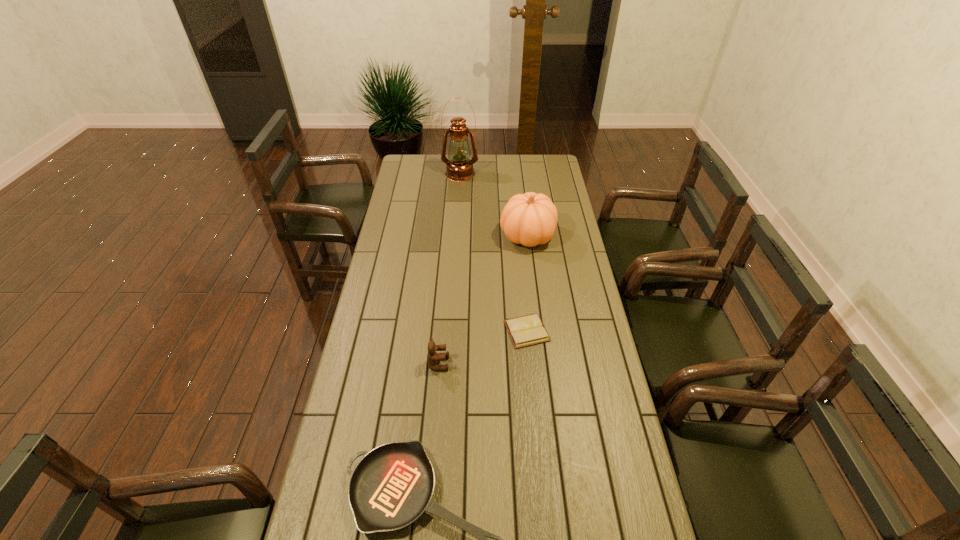
This screenshot has height=540, width=960. I want to click on vacant space situated on the face of the teddy bear, so click(548, 363).

What are the coordinates of `free space located 0.360m on the left of the third farthest object` in the screenshot? It's located at (403, 331).

Locate an element on the screen. This screenshot has height=540, width=960. object that is at the far edge is located at coordinates pos(459,168).

This screenshot has width=960, height=540. In order to click on object present at the right edge in this screenshot , I will do `click(529, 219)`.

In the image, there is a desktop. In order to click on vacant space at the far edge in this screenshot , I will do `click(437, 175)`.

You are a GUI agent. You are given a task and a screenshot of the screen. Output one action in this format:
    pyautogui.click(x=<x>, y=<y>)
    Task: Click on the free space at the left edge
    The width and height of the screenshot is (960, 540).
    Given the screenshot: What is the action you would take?
    pyautogui.click(x=390, y=259)

You are a GUI agent. You are given a task and a screenshot of the screen. Output one action in this format:
    pyautogui.click(x=<x>, y=<y>)
    Task: Click on the vacant point at the right edge
    
    Given the screenshot: What is the action you would take?
    pyautogui.click(x=540, y=178)

I want to click on free space that is in between the pumpkin and the tallest object, so click(x=493, y=205).

At what (x,y) coordinates should I click in order to perform the action: click on vacant region between the shortest object and the second nearest object. Please return your answer as a coordinate pair (x, y). Looking at the image, I should click on (483, 347).

This screenshot has height=540, width=960. Find the location of `empty location between the third tallest object and the fourth nearest object`. empty location between the third tallest object and the fourth nearest object is located at coordinates (483, 300).